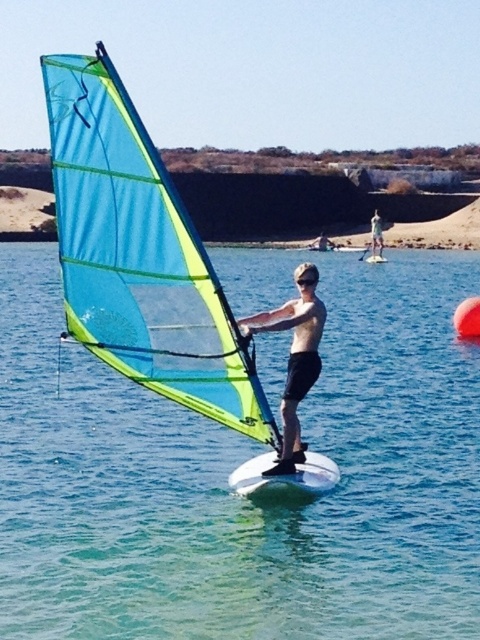
Does transparent plastic sail at center appear on the left side of translucent blue sail at center?

No, transparent plastic sail at center is not to the left of translucent blue sail at center.

Does transparent plastic sail at center appear under translucent blue sail at center?

Indeed, transparent plastic sail at center is positioned under translucent blue sail at center.

Between point (96, 480) and point (140, 288), which one is positioned in front?

Positioned in front is point (140, 288).

Identify the location of transparent plastic sail at center. This screenshot has width=480, height=640. (233, 467).

Is transparent plastic sail at center closer to the viewer compared to matte green sail at center?

Yes, transparent plastic sail at center is closer to the viewer.

Which is in front, point (93, 493) or point (296, 417)?

Point (296, 417)

Does point (90, 564) lie behind point (317, 320)?

No, (90, 564) is closer to viewer.

Find the location of `transparent plastic sail at center`. transparent plastic sail at center is located at coordinates (233, 467).

Where is `matte green sail at center`? Image resolution: width=480 pixels, height=640 pixels. matte green sail at center is located at coordinates (294, 358).

Does matte green sail at center appear on the right side of white glossy surfboard at center?

Yes, matte green sail at center is to the right of white glossy surfboard at center.

Find the location of a particular element. This screenshot has height=640, width=480. matte green sail at center is located at coordinates (294, 358).